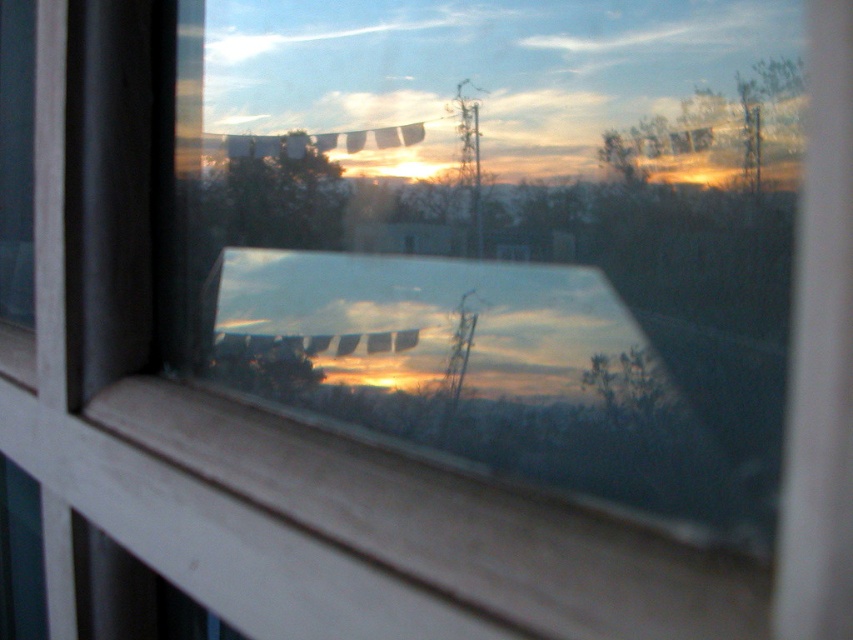
Based on the photo, can you confirm if transparent glass train window at center is taller than green matte tree at upper center?

Yes.

Between transparent glass train window at center and green matte tree at upper center, which one appears on the right side from the viewer's perspective?

transparent glass train window at center

Between point (207, 12) and point (248, 205), which one is positioned behind?

The point (207, 12) is more distant.

You are a GUI agent. You are given a task and a screenshot of the screen. Output one action in this format:
    pyautogui.click(x=<x>, y=<y>)
    Task: Click on the transparent glass train window at center
    This screenshot has height=640, width=853.
    Given the screenshot: What is the action you would take?
    pyautogui.click(x=506, y=232)